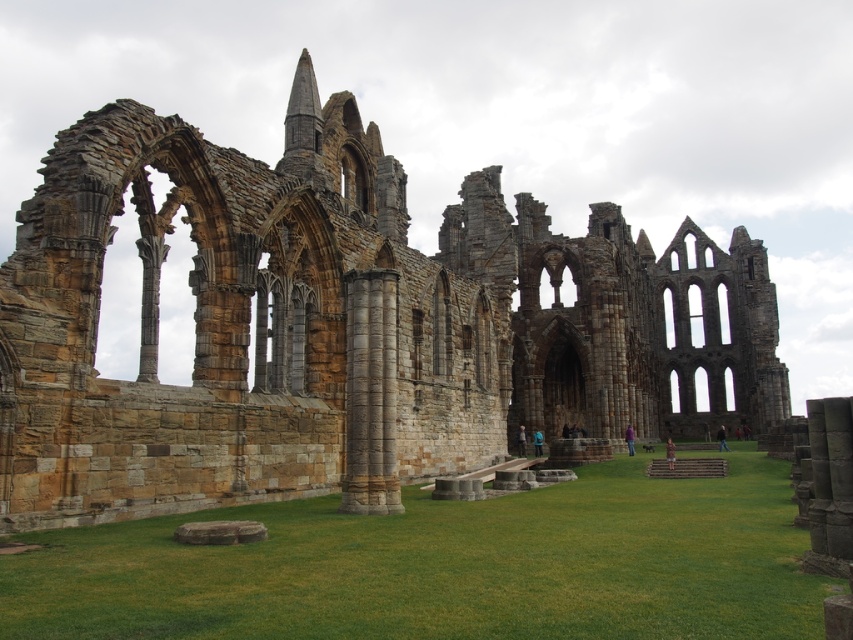
Question: Which point is farther to the camera?

Choices:
 (A) brown stone ruins at center
 (B) green grass at center

Answer: (A)

Question: Is brown stone ruins at center behind green grass at center?

Choices:
 (A) no
 (B) yes

Answer: (B)

Question: Is brown stone ruins at center above green grass at center?

Choices:
 (A) yes
 (B) no

Answer: (A)

Question: Can you confirm if brown stone ruins at center is positioned to the right of green grass at center?

Choices:
 (A) yes
 (B) no

Answer: (A)

Question: Among these points, which one is nearest to the camera?

Choices:
 (A) (421, 376)
 (B) (805, 624)

Answer: (B)